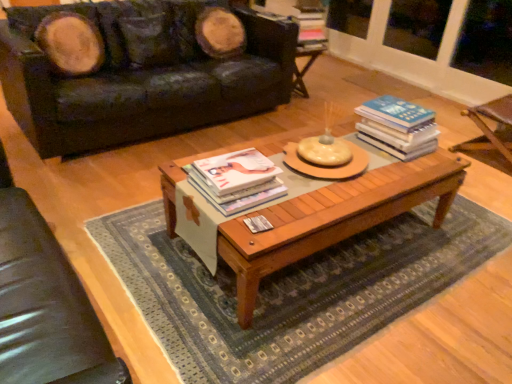
Question: From a real-world perspective, is matte white book at center, the 2th book in the right-to-left sequence, above or below hardcover book at center, which is the second book in front-to-back order?

Choices:
 (A) below
 (B) above

Answer: (A)

Question: From the image's perspective, relative to hardcover book at center, which appears as the first book when viewed from the right, is matte white book at center, arranged as the first book when viewed from the front, above or below?

Choices:
 (A) below
 (B) above

Answer: (A)

Question: Based on their relative distances, which object is nearer to the wooden armchair at right, the 1th armchair in the back-to-front sequence?

Choices:
 (A) wooden coffee table at center
 (B) wooden coffee table at center
 (C) leather couch at upper left
 (D) hardcover book at center, arranged as the first book when viewed from the top
 (E) matte white book at center, which is counted as the first book, starting from the bottom

Answer: (D)

Question: Considering the real-world distances, which object is farthest from the leather armchair at left, positioned as the 2th armchair in back-to-front order?

Choices:
 (A) wooden coffee table at center
 (B) hardcover book at center, the 1th book in the back-to-front sequence
 (C) leather couch at upper left
 (D) matte white book at center, the first book when ordered from left to right
 (E) wooden coffee table at center

Answer: (B)